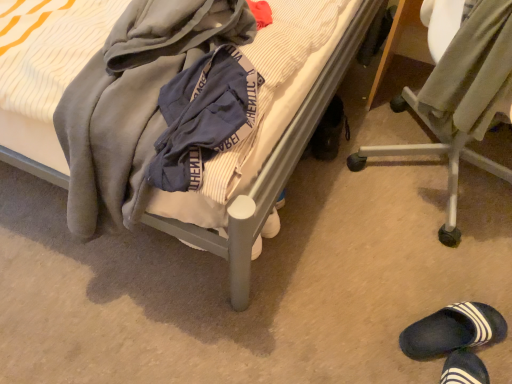
Question: Should I look upward or downward to see black rubber shoe at lower right, positioned as the second footwear in right-to-left order?

Choices:
 (A) down
 (B) up

Answer: (B)

Question: Does metallic silver chair at lower right appear on the right side of black rubber shoe at lower right, marked as the first footwear in a left-to-right arrangement?

Choices:
 (A) yes
 (B) no

Answer: (A)

Question: Is metallic silver chair at lower right oriented away from black rubber shoe at lower right, which appears as the 1th footwear when viewed from the back?

Choices:
 (A) yes
 (B) no

Answer: (A)

Question: From a real-world perspective, is metallic silver chair at lower right on top of black rubber shoe at lower right, positioned as the second footwear in right-to-left order?

Choices:
 (A) yes
 (B) no

Answer: (A)

Question: Considering the relative sizes of metallic silver chair at lower right and black rubber shoe at lower right, which is counted as the 2th footwear, starting from the bottom, in the image provided, is metallic silver chair at lower right taller than black rubber shoe at lower right, which is counted as the 2th footwear, starting from the bottom,?

Choices:
 (A) no
 (B) yes

Answer: (B)

Question: Can you confirm if metallic silver chair at lower right is positioned to the left of black rubber shoe at lower right, which appears as the 1th footwear when viewed from the back?

Choices:
 (A) no
 (B) yes

Answer: (A)

Question: Does metallic silver chair at lower right have a larger size compared to black rubber shoe at lower right, acting as the 2th footwear starting from the front?

Choices:
 (A) yes
 (B) no

Answer: (A)

Question: From a real-world perspective, does metallic silver chair at lower right stand above dark blue rubber slipper at lower right, the first footwear ordered from the bottom?

Choices:
 (A) yes
 (B) no

Answer: (A)

Question: Would you say metallic silver chair at lower right is outside dark blue rubber slipper at lower right, which appears as the 1th footwear when viewed from the front?

Choices:
 (A) no
 (B) yes

Answer: (B)

Question: Considering the relative sizes of metallic silver chair at lower right and dark blue rubber slipper at lower right, the 2th footwear positioned from the back, in the image provided, is metallic silver chair at lower right thinner than dark blue rubber slipper at lower right, the 2th footwear positioned from the back,?

Choices:
 (A) no
 (B) yes

Answer: (A)

Question: Does metallic silver chair at lower right have a greater width compared to dark blue rubber slipper at lower right, the 2th footwear positioned from the back?

Choices:
 (A) no
 (B) yes

Answer: (B)

Question: Is metallic silver chair at lower right further to camera compared to dark blue rubber slipper at lower right, the 2th footwear from the left?

Choices:
 (A) yes
 (B) no

Answer: (B)

Question: Is metallic silver chair at lower right positioned far away from dark blue rubber slipper at lower right, the first footwear ordered from the bottom?

Choices:
 (A) yes
 (B) no

Answer: (B)

Question: Is black rubber shoe at lower right, positioned as the second footwear in right-to-left order, inside dark blue rubber slipper at lower right, the 2th footwear positioned from the back?

Choices:
 (A) yes
 (B) no

Answer: (B)